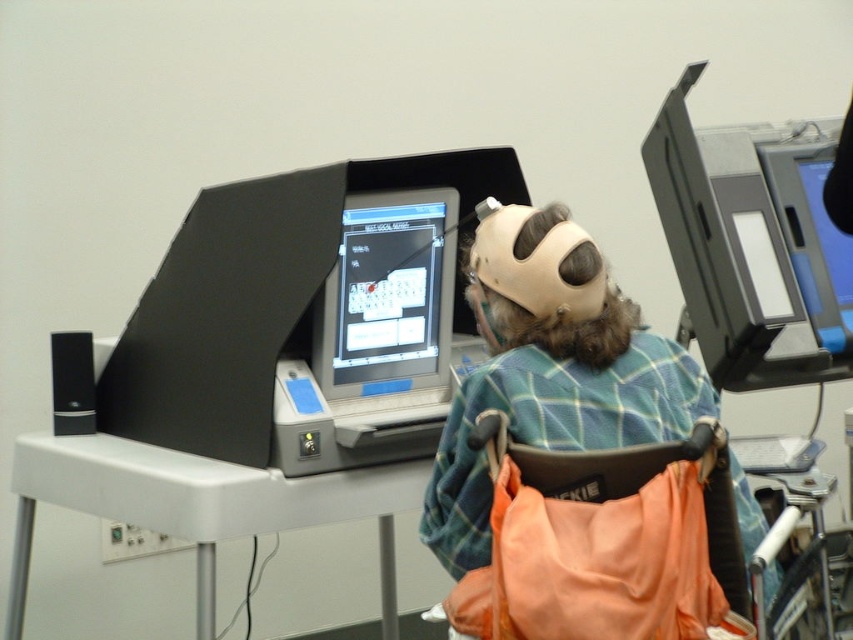
Question: Where is gray plastic voting machine at center located in relation to matte plastic monitor at upper right in the image?

Choices:
 (A) left
 (B) right

Answer: (A)

Question: Is plaid fabric shirt at center to the left of matte plastic monitor at upper right from the viewer's perspective?

Choices:
 (A) no
 (B) yes

Answer: (B)

Question: Is orange fabric chair at lower right positioned at the back of white plastic computer desk at lower left?

Choices:
 (A) yes
 (B) no

Answer: (B)

Question: Considering the real-world distances, which object is closest to the matte plastic monitor at upper right?

Choices:
 (A) orange fabric chair at lower right
 (B) plaid fabric shirt at center

Answer: (B)

Question: Which point is farther to the camera?

Choices:
 (A) white plastic computer desk at lower left
 (B) plaid fabric shirt at center
 (C) gray plastic voting machine at center

Answer: (C)

Question: Which of the following is the closest to the observer?

Choices:
 (A) gray plastic voting machine at center
 (B) plaid fabric shirt at center
 (C) orange fabric chair at lower right

Answer: (C)